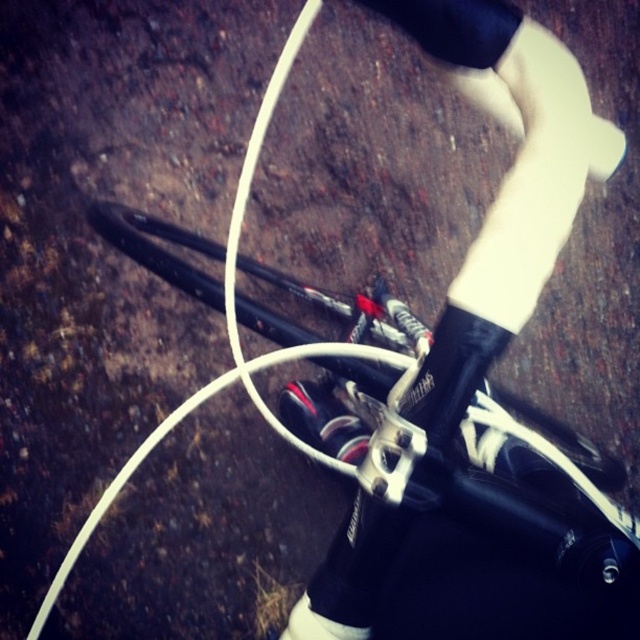
You are riding a bicycle and notice two shoes at the center of your view. Which shoe is closer to you, the shiny black shoe at center or the white matte shoe at center?

The shiny black shoe at center is closer to you than the white matte shoe at center because it is further to the viewer.